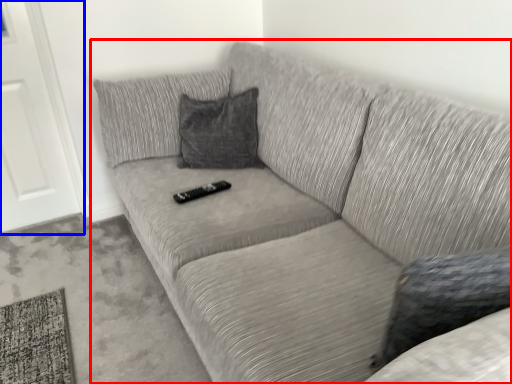
Question: Which point is closer to the camera, studio couch (highlighted by a red box) or door (highlighted by a blue box)?

Choices:
 (A) studio couch
 (B) door

Answer: (A)